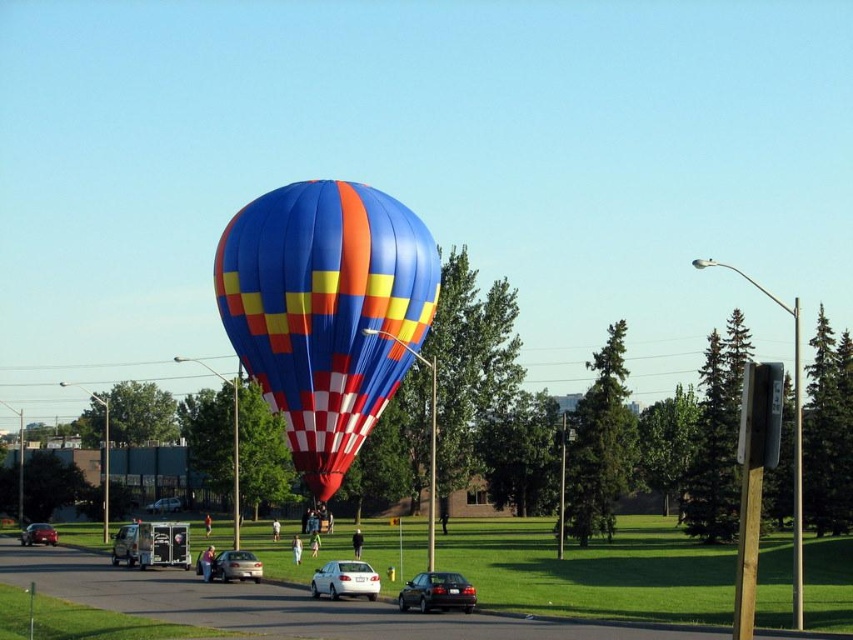
This screenshot has width=853, height=640. What do you see at coordinates (437, 593) in the screenshot?
I see `shiny black sedan at center` at bounding box center [437, 593].

Describe the element at coordinates (437, 593) in the screenshot. The width and height of the screenshot is (853, 640). I see `shiny black sedan at center` at that location.

You are a GUI agent. You are given a task and a screenshot of the screen. Output one action in this format:
    pyautogui.click(x=<x>, y=<y>)
    Task: Click on the shiny black sedan at center
    
    Given the screenshot: What is the action you would take?
    pyautogui.click(x=437, y=593)

Which is in front, point (339, 572) or point (161, 508)?

Point (339, 572) is in front.

Is the position of white matte sedan at center less distant than that of silver metallic car at center?

Yes.

Between point (375, 586) and point (161, 512), which one is positioned behind?

Point (161, 512)

Identify the location of white matte sedan at center. (345, 580).

Can you confirm if metallic gray pole at right is bigger than shiny black sedan at center?

Yes.

Is metallic gray pole at right further to camera compared to shiny black sedan at center?

No.

Find the location of a particular element. The width and height of the screenshot is (853, 640). metallic gray pole at right is located at coordinates (798, 474).